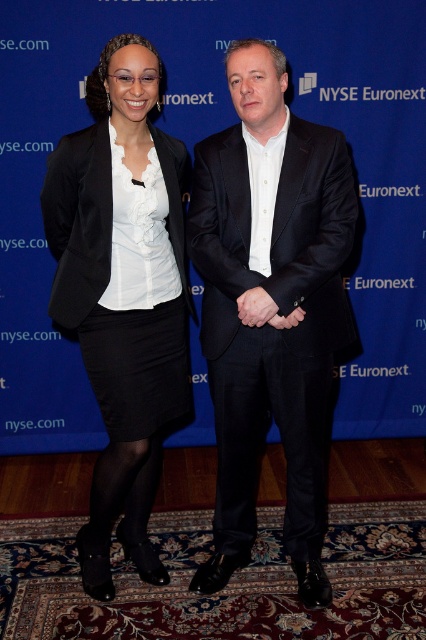
You are an assistant at the NYSE Euronext event and need to arrange the items in the image. According to the scene, where should you place the black matte suit at center in relation to the matte black hand at center?

The black matte suit at center should be placed below the matte black hand at center as per the description.

You are a photographer standing 2 meters away from the backdrop. You want to take a closeup shot of the matte black skirt at left without moving the camera. Is it possible?

The matte black skirt at left is 1.91 meters from camera, so yes, the photographer can take a closeup shot without moving the camera since the distance is within the 2 meters range.